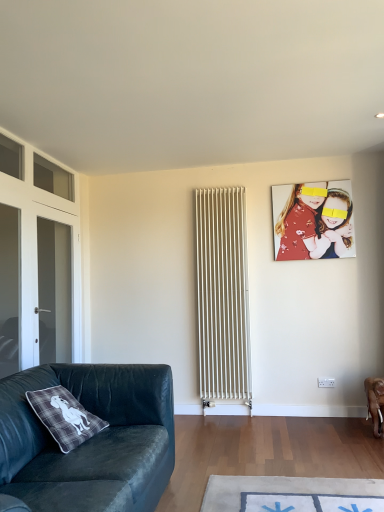
Locate an element on the screen. The width and height of the screenshot is (384, 512). vacant region to the right of white metal radiator at center is located at coordinates (269, 420).